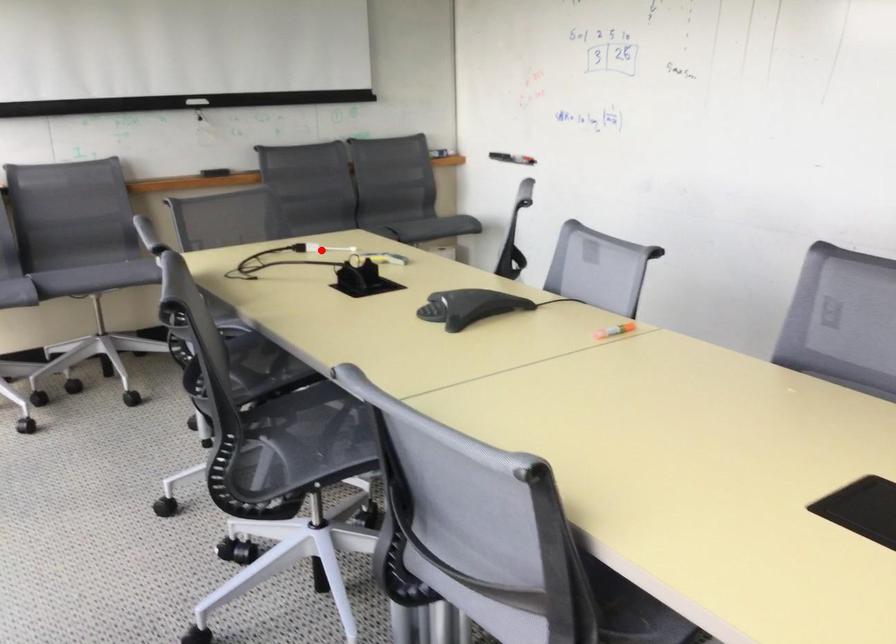
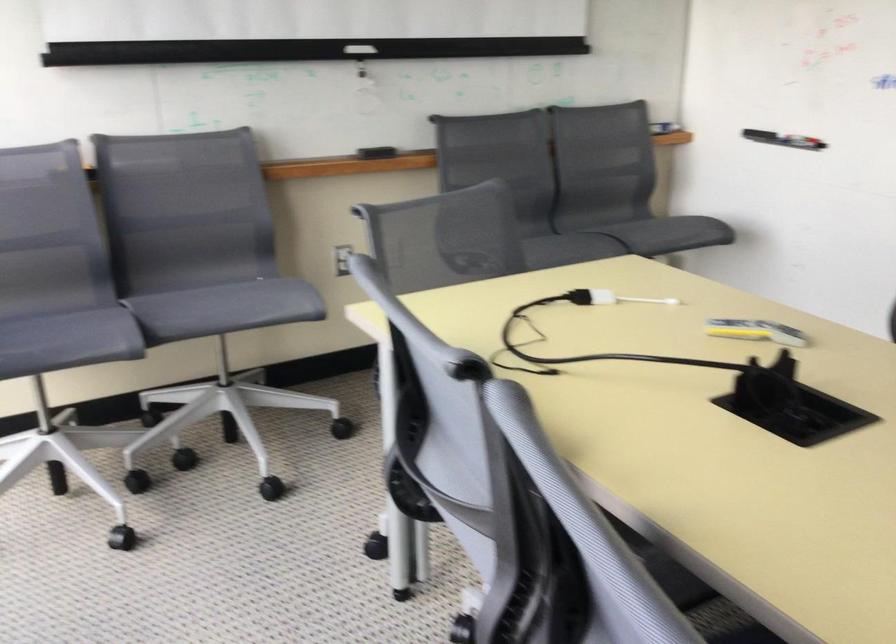
Question: I am providing you with two images of the same scene from different viewpoints. In image1, a red point is highlighted. Considering the same 3D point in image2, which of the following is correct?

Choices:
 (A) It is closer
 (B) It is farther

Answer: (A)